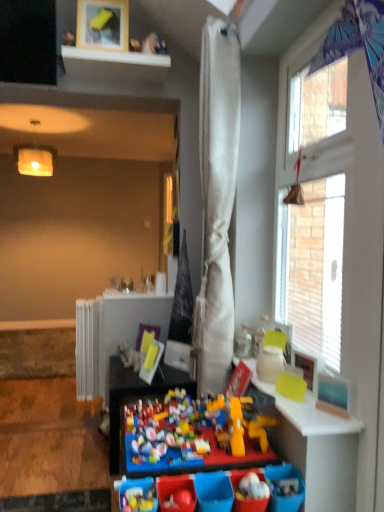
Question: From the image's perspective, would you say multicolored plastic lego at center, arranged as the 2th table when viewed from the front, is positioned over white textured curtain at upper right?

Choices:
 (A) yes
 (B) no

Answer: (B)

Question: Can we say multicolored plastic lego at center, the 2th table positioned from the top, lies outside white textured curtain at upper right?

Choices:
 (A) yes
 (B) no

Answer: (A)

Question: From the image's perspective, does multicolored plastic lego at center, the first table when ordered from back to front, appear lower than white textured curtain at upper right?

Choices:
 (A) yes
 (B) no

Answer: (A)

Question: Can you confirm if multicolored plastic lego at center, the first table when ordered from back to front, is positioned to the right of white textured curtain at upper right?

Choices:
 (A) no
 (B) yes

Answer: (A)

Question: Is multicolored plastic lego at center, which is the 1th table from left to right, in front of white textured curtain at upper right?

Choices:
 (A) no
 (B) yes

Answer: (A)

Question: From the image's perspective, is white fabric curtain at center located above or below white textured curtain at upper right?

Choices:
 (A) above
 (B) below

Answer: (B)

Question: Does point (218, 282) appear closer or farther from the camera than point (286, 119)?

Choices:
 (A) farther
 (B) closer

Answer: (A)

Question: Relative to white textured curtain at upper right, is white fabric curtain at center in front or behind?

Choices:
 (A) front
 (B) behind

Answer: (B)

Question: Visually, is white fabric curtain at center positioned to the left or to the right of white textured curtain at upper right?

Choices:
 (A) right
 (B) left

Answer: (B)

Question: In the image, is matte yellow table at right, arranged as the first table when viewed from the right, positioned in front of or behind multicolored plastic lego at center, arranged as the 2th table when viewed from the front?

Choices:
 (A) front
 (B) behind

Answer: (A)

Question: From the image's perspective, is matte yellow table at right, the 2th table viewed from the back, above or below multicolored plastic lego at center, the first table when ordered from back to front?

Choices:
 (A) below
 (B) above

Answer: (B)

Question: Does point (342, 437) appear closer or farther from the camera than point (124, 394)?

Choices:
 (A) closer
 (B) farther

Answer: (A)

Question: From a real-world perspective, is matte yellow table at right, the 2th table viewed from the back, above or below multicolored plastic lego at center, which is the 1th table from left to right?

Choices:
 (A) above
 (B) below

Answer: (A)

Question: Is matte yellow table at right, which appears as the 1th table when viewed from the top, in front of or behind white glossy shelf at upper center in the image?

Choices:
 (A) front
 (B) behind

Answer: (A)

Question: Which is correct: matte yellow table at right, marked as the second table in a left-to-right arrangement, is inside white glossy shelf at upper center, or outside of it?

Choices:
 (A) inside
 (B) outside

Answer: (B)